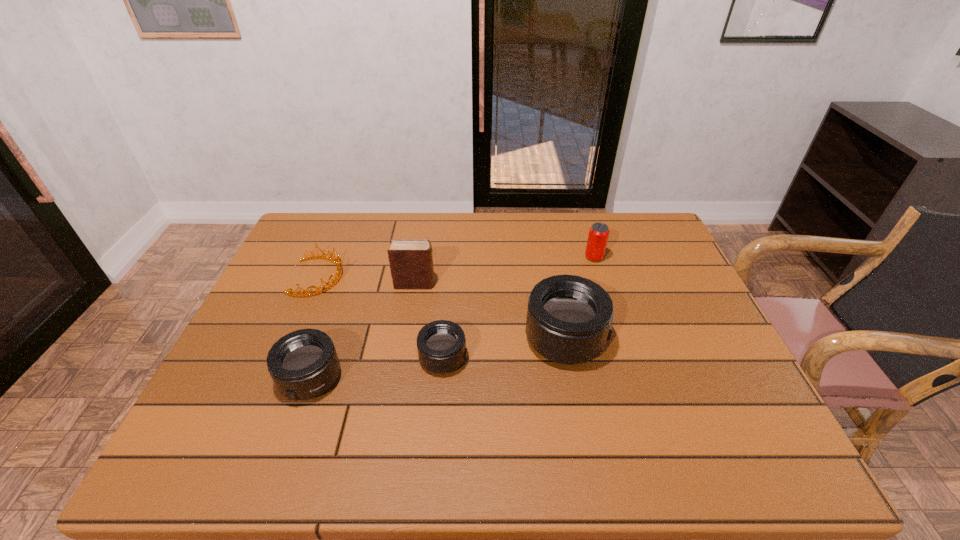
Where is `the second tallest telephoto lens`? The height and width of the screenshot is (540, 960). the second tallest telephoto lens is located at coordinates (303, 364).

The height and width of the screenshot is (540, 960). I want to click on the leftmost telephoto lens, so click(303, 364).

At what (x,y) coordinates should I click in order to perform the action: click on the shortest telephoto lens. Please return your answer as a coordinate pair (x, y). The image size is (960, 540). Looking at the image, I should click on (441, 344).

I want to click on the fifth object from left to right, so click(569, 317).

Identify the location of the rightmost telephoto lens. (569, 317).

Identify the location of tiara. (338, 274).

What are the coordinates of `the third tallest object` in the screenshot? It's located at (598, 235).

Find the location of a particular element. can is located at coordinates (598, 235).

This screenshot has height=540, width=960. In order to click on diary in this screenshot , I will do `click(411, 262)`.

The width and height of the screenshot is (960, 540). I want to click on vacant space located 0.300m on the side of the shortest telephoto lens with brand markings and control switches, so click(x=589, y=358).